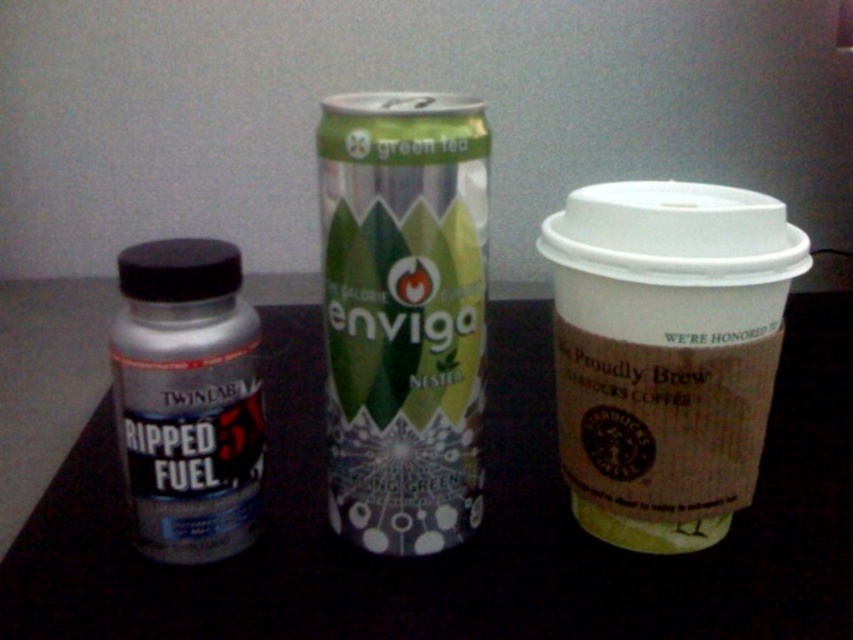
Does white paper cup at right appear under silver metallic bottle at left?

Incorrect, white paper cup at right is not positioned below silver metallic bottle at left.

This screenshot has width=853, height=640. Describe the element at coordinates (666, 353) in the screenshot. I see `white paper cup at right` at that location.

This screenshot has width=853, height=640. I want to click on white paper cup at right, so click(666, 353).

Does white paper cup at right appear under green matte can at center?

Yes.

The height and width of the screenshot is (640, 853). Describe the element at coordinates (666, 353) in the screenshot. I see `white paper cup at right` at that location.

Identify the location of white paper cup at right. (666, 353).

Does green matte can at center have a lesser height compared to silver metallic bottle at left?

Incorrect, green matte can at center's height does not fall short of silver metallic bottle at left's.

Can you confirm if green matte can at center is wider than silver metallic bottle at left?

Yes, green matte can at center is wider than silver metallic bottle at left.

What do you see at coordinates (403, 316) in the screenshot? The height and width of the screenshot is (640, 853). I see `green matte can at center` at bounding box center [403, 316].

At what (x,y) coordinates should I click in order to perform the action: click on green matte can at center. Please return your answer as a coordinate pair (x, y). The width and height of the screenshot is (853, 640). Looking at the image, I should click on (403, 316).